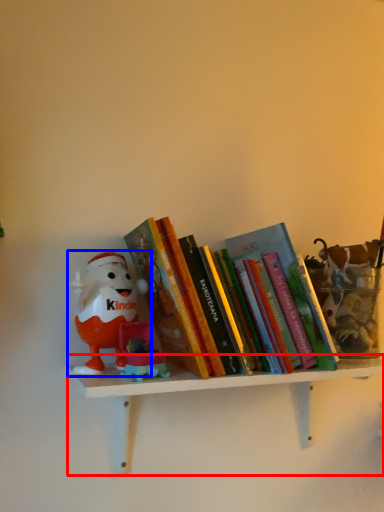
Question: Which point is closer to the camera, shelf (highlighted by a red box) or toy (highlighted by a blue box)?

Choices:
 (A) shelf
 (B) toy

Answer: (A)